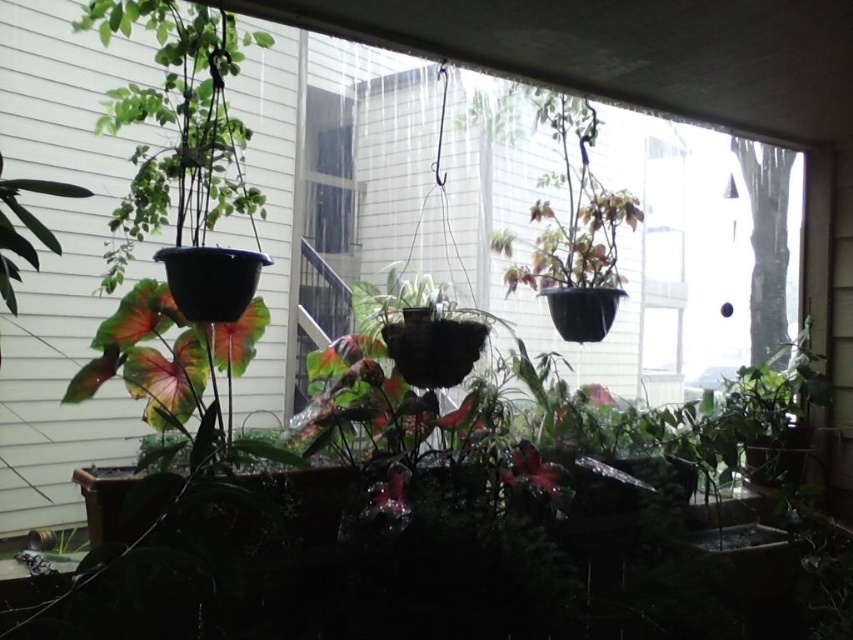
Question: Can you confirm if matte black pot at left is wider than green matte leaf at left?

Choices:
 (A) no
 (B) yes

Answer: (A)

Question: Which object is closer to the camera taking this photo?

Choices:
 (A) matte black pot at left
 (B) green matte hanging plant at upper center
 (C) green matte leaf at lower left
 (D) green matte leaf at left

Answer: (D)

Question: Does matte black pot at left appear over green matte leaf at lower left?

Choices:
 (A) no
 (B) yes

Answer: (B)

Question: Which object is closer to the camera taking this photo?

Choices:
 (A) matte black pot at left
 (B) green matte leaf at left
 (C) green matte hanging plant at upper center
 (D) green matte leaf at lower left

Answer: (B)

Question: Based on their relative distances, which object is nearer to the green matte hanging plant at upper center?

Choices:
 (A) green matte leaf at lower left
 (B) matte black pot at left
 (C) green matte leaf at left

Answer: (B)

Question: Can you confirm if green matte leaf at left is thinner than green matte leaf at lower left?

Choices:
 (A) yes
 (B) no

Answer: (B)